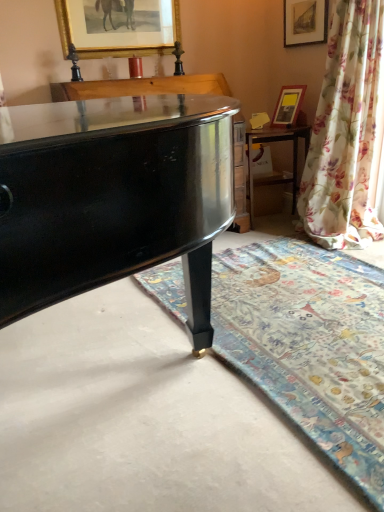
The height and width of the screenshot is (512, 384). What are the coordinates of `wooden table at right` in the screenshot? It's located at (276, 142).

In order to click on matte gold picture frame at upper right, which appears as the second picture frame when viewed from the right in this screenshot , I will do click(x=288, y=106).

Image resolution: width=384 pixels, height=512 pixels. Identify the location of floral fabric curtain at right. (346, 131).

The height and width of the screenshot is (512, 384). What do you see at coordinates (118, 27) in the screenshot?
I see `gold-framed picture at upper center, which appears as the third picture frame when viewed from the right` at bounding box center [118, 27].

You are a GUI agent. You are given a task and a screenshot of the screen. Output one action in this format:
    pyautogui.click(x=<x>, y=<y>)
    Task: Click on the wooden table at right
    
    Given the screenshot: What is the action you would take?
    pyautogui.click(x=276, y=142)

Who is smaller, gold-framed picture at upper center, which is the first picture frame in left-to-right order, or wooden table at right?

Smaller between the two is gold-framed picture at upper center, which is the first picture frame in left-to-right order.

Based on the photo, from the image's perspective, which is below, gold-framed picture at upper center, which appears as the third picture frame when viewed from the right, or wooden table at right?

wooden table at right is shown below in the image.

Locate an element on the screen. the 2nd picture frame located above the wooden table at right (from a real-world perspective) is located at coordinates (118, 27).

Is gold-framed picture at upper center, which appears as the third picture frame when viewed from the right, bigger than carpet with floral pattern at lower right?

No.

Consider the image. How many degrees apart are the facing directions of gold-framed picture at upper center, which appears as the third picture frame when viewed from the right, and carpet with floral pattern at lower right?

gold-framed picture at upper center, which appears as the third picture frame when viewed from the right, and carpet with floral pattern at lower right are facing 86.9 degrees away from each other.

Consider the image. From a real-world perspective, does gold-framed picture at upper center, which is the first picture frame in left-to-right order, sit lower than carpet with floral pattern at lower right?

Actually, gold-framed picture at upper center, which is the first picture frame in left-to-right order, is physically above carpet with floral pattern at lower right in the real world.

Is gold-framed picture at upper center, which appears as the third picture frame when viewed from the right, next to carpet with floral pattern at lower right?

gold-framed picture at upper center, which appears as the third picture frame when viewed from the right, and carpet with floral pattern at lower right are clearly separated.

From the image's perspective, is carpet with floral pattern at lower right on top of wooden table at right?

No, from the image's perspective, carpet with floral pattern at lower right is not over wooden table at right.

Considering the positions of point (322, 271) and point (251, 151), is point (322, 271) closer or farther from the camera than point (251, 151)?

Point (322, 271).

From a real-world perspective, which object stands above the other?

wooden table at right.

Where is `table located above the carpet with floral pattern at lower right (from a real-world perspective)`? This screenshot has width=384, height=512. table located above the carpet with floral pattern at lower right (from a real-world perspective) is located at coordinates (276, 142).

Would you say matte gold picture frame at upper right, which ranks as the first picture frame in right-to-left order, is inside or outside floral fabric curtain at right?

matte gold picture frame at upper right, which ranks as the first picture frame in right-to-left order, is outside floral fabric curtain at right.

In the scene shown: How many degrees apart are the facing directions of matte gold picture frame at upper right, which is the third picture frame from left to right, and floral fabric curtain at right?

1.92 degrees separate the facing orientations of matte gold picture frame at upper right, which is the third picture frame from left to right, and floral fabric curtain at right.

From the image's perspective, is matte gold picture frame at upper right, which is the third picture frame from left to right, positioned above or below floral fabric curtain at right?

matte gold picture frame at upper right, which is the third picture frame from left to right, is situated higher than floral fabric curtain at right in the image.

Based on the photo, from a real-world perspective, relative to floral fabric curtain at right, is matte gold picture frame at upper right, which ranks as the first picture frame in right-to-left order, vertically above or below?

matte gold picture frame at upper right, which ranks as the first picture frame in right-to-left order, is situated higher than floral fabric curtain at right in the real world.

Based on the photo, could you tell me if floral fabric curtain at right is facing wooden table at right?

No, floral fabric curtain at right is not oriented towards wooden table at right.

How different are the orientations of floral fabric curtain at right and wooden table at right in degrees?

The angular difference between floral fabric curtain at right and wooden table at right is 77.2 degrees.

Considering their positions, is floral fabric curtain at right located in front of or behind wooden table at right?

floral fabric curtain at right is in front of wooden table at right.

Locate an element on the screen. curtain above the wooden table at right (from a real-world perspective) is located at coordinates (346, 131).

Would you consider matte gold picture frame at upper right, the 2th picture frame when ordered from left to right, to be distant from floral fabric curtain at right?

No.

Can you confirm if matte gold picture frame at upper right, which appears as the second picture frame when viewed from the right, is smaller than floral fabric curtain at right?

Yes.

From the image's perspective, is matte gold picture frame at upper right, which appears as the second picture frame when viewed from the right, located above or below floral fabric curtain at right?

Based on their image positions, matte gold picture frame at upper right, which appears as the second picture frame when viewed from the right, is located above floral fabric curtain at right.

Which of these two, gold-framed picture at upper center, which appears as the third picture frame when viewed from the right, or matte gold picture frame at upper right, which is the third picture frame from left to right, stands taller?

gold-framed picture at upper center, which appears as the third picture frame when viewed from the right.

Is point (111, 48) behind point (309, 15)?

No, (111, 48) is closer to viewer.

From the image's perspective, is gold-framed picture at upper center, which appears as the third picture frame when viewed from the right, positioned above or below matte gold picture frame at upper right, which ranks as the first picture frame in right-to-left order?

From the image's perspective, gold-framed picture at upper center, which appears as the third picture frame when viewed from the right, appears below matte gold picture frame at upper right, which ranks as the first picture frame in right-to-left order.

From a real-world perspective, starting from the wooden table at right, which picture frame is the 2nd one vertically above it? Please provide its 2D coordinates.

[(118, 27)]

I want to click on picture frame that is the 1st one when counting backward from the carpet with floral pattern at lower right, so click(118, 27).

Considering their positions, is carpet with floral pattern at lower right positioned further to floral fabric curtain at right than wooden table at right?

The object further to floral fabric curtain at right is carpet with floral pattern at lower right.

When comparing their distances from matte gold picture frame at upper right, which is the third picture frame from left to right, does matte gold picture frame at upper right, the 2th picture frame when ordered from left to right, or wooden table at right seem closer?

Based on the image, matte gold picture frame at upper right, the 2th picture frame when ordered from left to right, appears to be nearer to matte gold picture frame at upper right, which is the third picture frame from left to right.

From the image, which object appears to be nearer to matte gold picture frame at upper right, which ranks as the first picture frame in right-to-left order, gold-framed picture at upper center, which is the first picture frame in left-to-right order, or wooden table at right?

Based on the image, wooden table at right appears to be nearer to matte gold picture frame at upper right, which ranks as the first picture frame in right-to-left order.

Considering their positions, is matte gold picture frame at upper right, which is the third picture frame from left to right, positioned further to wooden table at right than carpet with floral pattern at lower right?

Among the two, carpet with floral pattern at lower right is located further to wooden table at right.

Based on their spatial positions, is wooden table at right or floral fabric curtain at right closer to matte gold picture frame at upper right, which ranks as the first picture frame in right-to-left order?

floral fabric curtain at right is positioned closer to the anchor matte gold picture frame at upper right, which ranks as the first picture frame in right-to-left order.

Based on their spatial positions, is floral fabric curtain at right or carpet with floral pattern at lower right closer to wooden table at right?

Among the two, floral fabric curtain at right is located nearer to wooden table at right.

From the image, which object appears to be nearer to matte gold picture frame at upper right, the 2th picture frame when ordered from left to right, floral fabric curtain at right or wooden table at right?

wooden table at right is closer to matte gold picture frame at upper right, the 2th picture frame when ordered from left to right.

Looking at this image, from the image, which object appears to be nearer to gold-framed picture at upper center, which is the first picture frame in left-to-right order, wooden table at right or matte gold picture frame at upper right, the 2th picture frame when ordered from left to right?

wooden table at right lies closer to gold-framed picture at upper center, which is the first picture frame in left-to-right order, than the other object.

At what (x,y) coordinates should I click in order to perform the action: click on table between matte gold picture frame at upper right, which is the third picture frame from left to right, and carpet with floral pattern at lower right vertically. Please return your answer as a coordinate pair (x, y). This screenshot has height=512, width=384. Looking at the image, I should click on (276, 142).

You are a GUI agent. You are given a task and a screenshot of the screen. Output one action in this format:
    pyautogui.click(x=<x>, y=<y>)
    Task: Click on the picture frame between gold-framed picture at upper center, which is the first picture frame in left-to-right order, and matte gold picture frame at upper right, which is the third picture frame from left to right, in the horizontal direction
    Image resolution: width=384 pixels, height=512 pixels.
    Given the screenshot: What is the action you would take?
    pyautogui.click(x=288, y=106)

The image size is (384, 512). Find the location of `table between gold-framed picture at upper center, which appears as the third picture frame when viewed from the right, and matte gold picture frame at upper right, which is the third picture frame from left to right, in the horizontal direction`. table between gold-framed picture at upper center, which appears as the third picture frame when viewed from the right, and matte gold picture frame at upper right, which is the third picture frame from left to right, in the horizontal direction is located at coordinates (276, 142).

Find the location of a particular element. Image resolution: width=384 pixels, height=512 pixels. curtain between matte gold picture frame at upper right, which ranks as the first picture frame in right-to-left order, and wooden table at right from top to bottom is located at coordinates (346, 131).